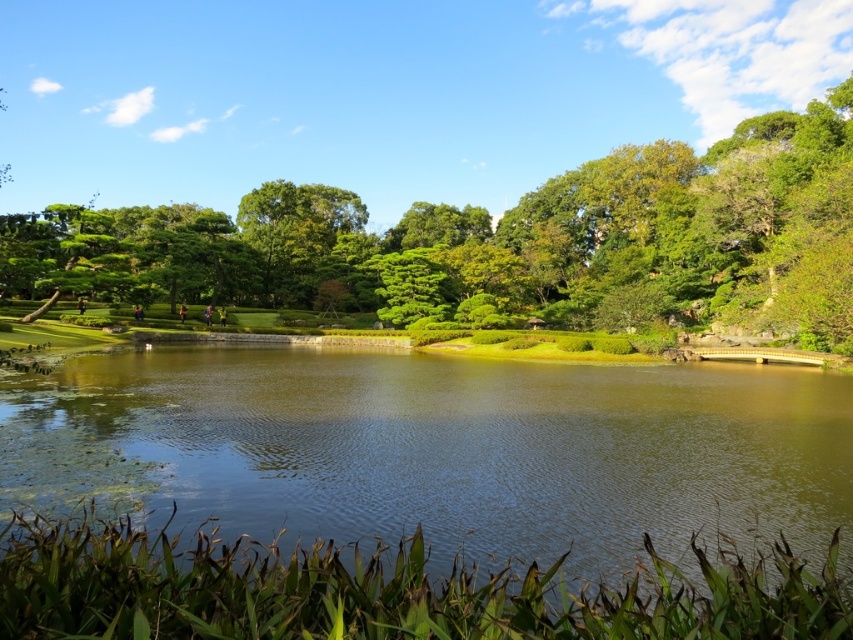
Does green grassy lake at center appear on the left side of green leafy tree at center?

In fact, green grassy lake at center is to the right of green leafy tree at center.

Which is more to the left, green grassy lake at center or green leafy tree at center?

Positioned to the left is green leafy tree at center.

This screenshot has height=640, width=853. Find the location of `green grassy lake at center`. green grassy lake at center is located at coordinates (422, 497).